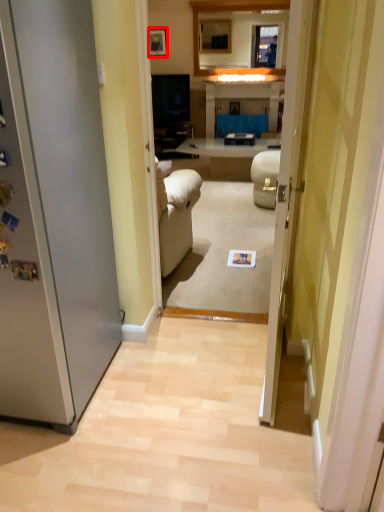
Question: From the image's perspective, where is picture frame (annotated by the red box) located relative to glass door?

Choices:
 (A) above
 (B) below

Answer: (A)